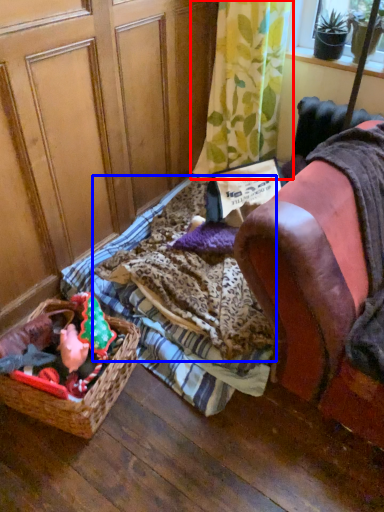
Question: Which of the following is the farthest to the observer, curtain (highlighted by a red box) or blanket (highlighted by a blue box)?

Choices:
 (A) curtain
 (B) blanket

Answer: (A)